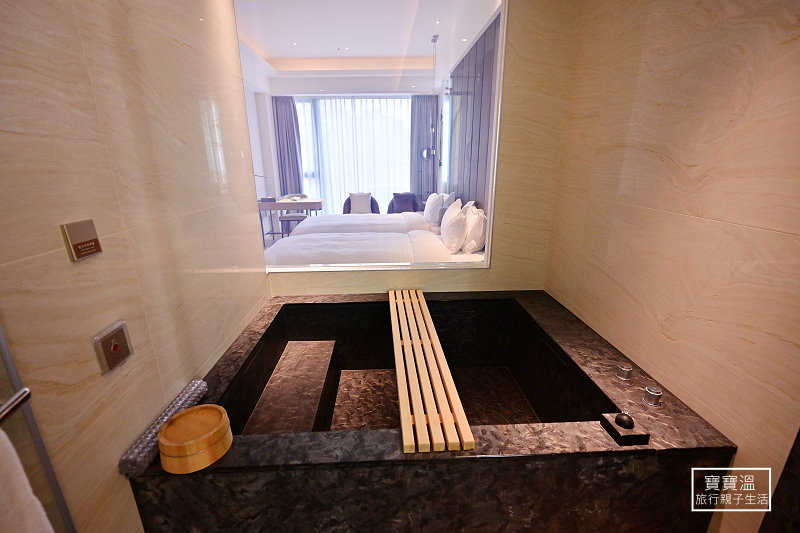
What are the coordinates of `wooden shelf board` in the screenshot? It's located at (436, 403).